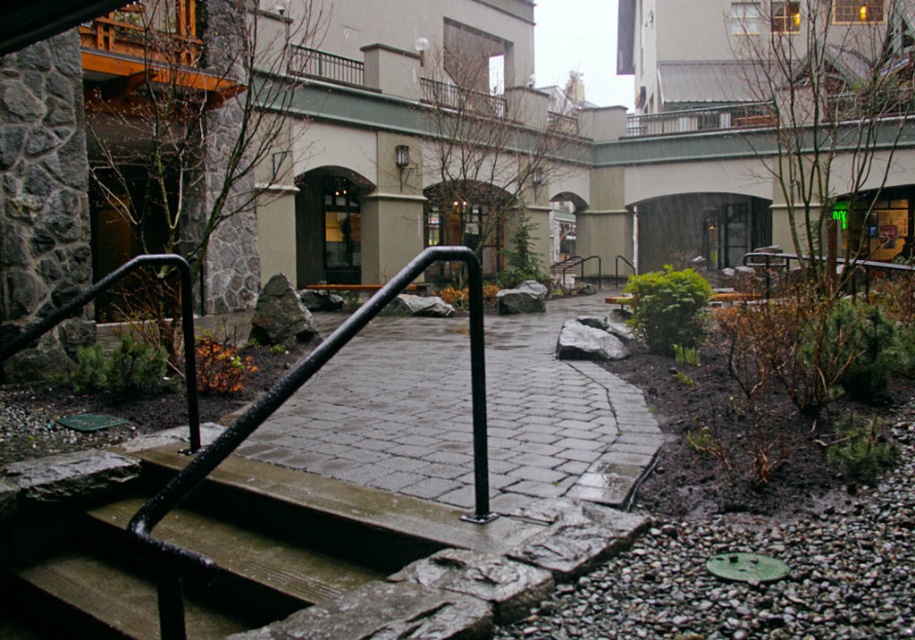
Is point (338, 397) closer to viewer compared to point (104, 577)?

No.

Between point (526, 369) and point (145, 637), which one is positioned in front?

Point (145, 637)

Which is in front, point (271, 452) or point (187, 605)?

Point (187, 605) is in front.

Locate an element on the screen. black metal railing at center is located at coordinates (381, 417).